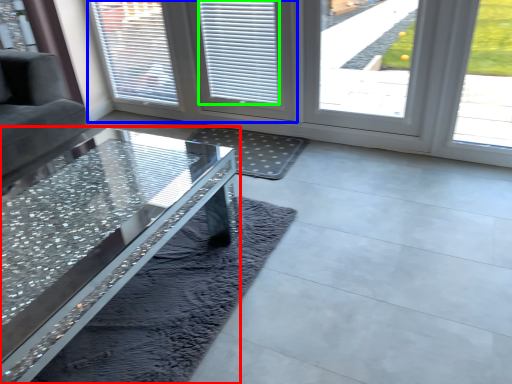
Question: Estimate the real-world distances between objects in this image. Which object is closer to table (highlighted by a red box), screen door (highlighted by a blue box) or blind (highlighted by a green box)?

Choices:
 (A) screen door
 (B) blind

Answer: (B)